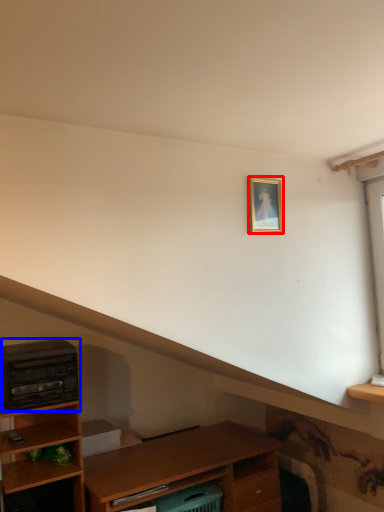
Question: Which of the following is the farthest to the observer, picture frame (highlighted by a red box) or appliance (highlighted by a blue box)?

Choices:
 (A) picture frame
 (B) appliance

Answer: (B)